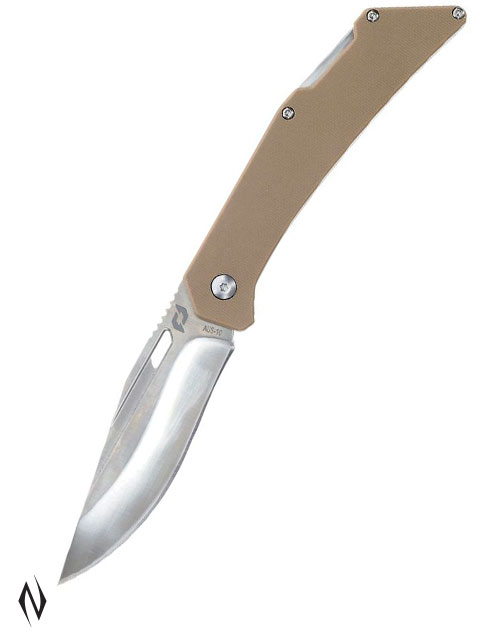
This screenshot has height=640, width=480. I want to click on screws, so click(x=226, y=283), click(x=288, y=112), click(x=373, y=15), click(x=457, y=13).